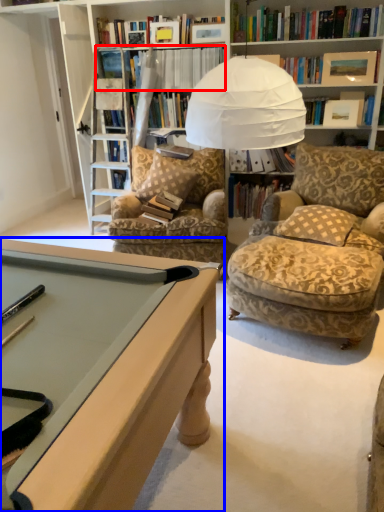
Question: Which object is further to the camera taking this photo, book (highlighted by a red box) or desk (highlighted by a blue box)?

Choices:
 (A) book
 (B) desk

Answer: (A)